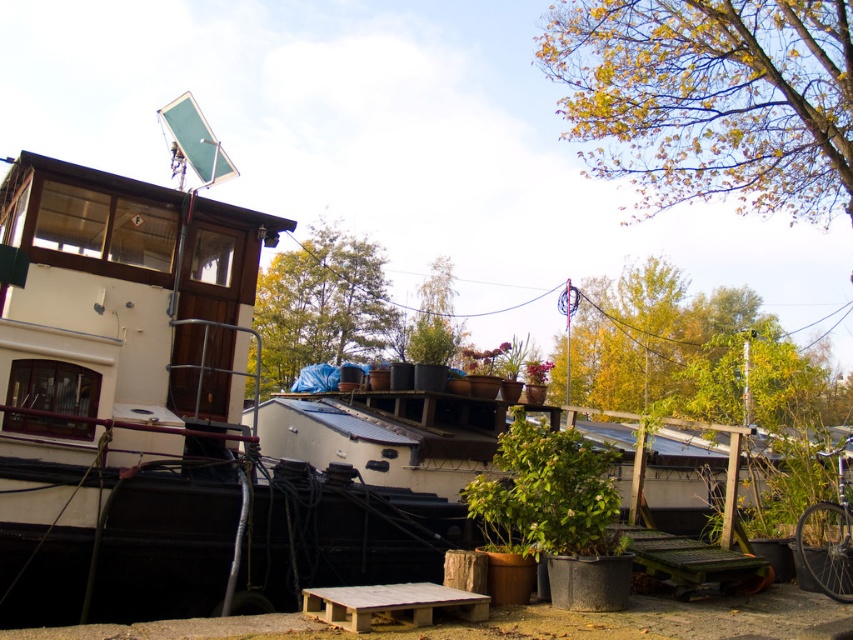
Does point (573, 490) lie behind point (466, 595)?

That is True.

Between green glossy plant at center and wooden pallet at center, which one appears on the left side from the viewer's perspective?

Positioned to the left is wooden pallet at center.

Is point (543, 444) positioned before point (364, 628)?

No, (543, 444) is further to viewer.

You are a GUI agent. You are given a task and a screenshot of the screen. Output one action in this format:
    pyautogui.click(x=<x>, y=<y>)
    Task: Click on the green glossy plant at center
    The image size is (853, 640).
    Given the screenshot: What is the action you would take?
    pyautogui.click(x=546, y=493)

You are a GUI agent. You are given a task and a screenshot of the screen. Output one action in this format:
    pyautogui.click(x=<x>, y=<y>)
    Task: Click on the yellow leafy branches at upper right
    This screenshot has height=640, width=853.
    Given the screenshot: What is the action you would take?
    pyautogui.click(x=711, y=99)

Who is more distant from viewer, (653, 182) or (596, 541)?

The point (653, 182) is behind.

This screenshot has width=853, height=640. What are the coordinates of `yellow leafy branches at upper right` in the screenshot? It's located at (711, 99).

Is yellow leafy branches at upper right closer to the viewer compared to green leafy tree at upper center?

Yes, it is in front of green leafy tree at upper center.

Does yellow leafy branches at upper right have a larger size compared to green leafy tree at upper center?

Correct, yellow leafy branches at upper right is larger in size than green leafy tree at upper center.

Image resolution: width=853 pixels, height=640 pixels. What do you see at coordinates (711, 99) in the screenshot?
I see `yellow leafy branches at upper right` at bounding box center [711, 99].

Locate an element on the screen. yellow leafy branches at upper right is located at coordinates (711, 99).